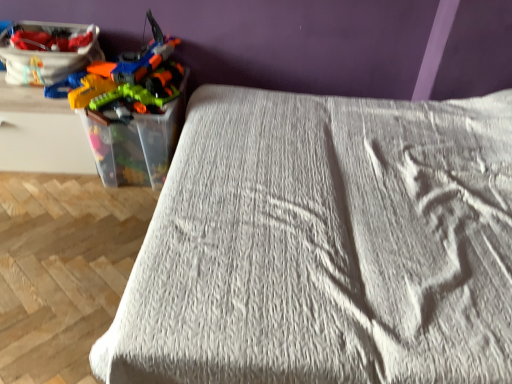
Question: Considering the relative sizes of translucent plastic toy guns at left and white textured bed at center in the image provided, is translucent plastic toy guns at left bigger than white textured bed at center?

Choices:
 (A) yes
 (B) no

Answer: (B)

Question: Is translucent plastic toy guns at left closer to camera compared to white textured bed at center?

Choices:
 (A) yes
 (B) no

Answer: (B)

Question: From the image's perspective, does translucent plastic toy guns at left appear lower than white textured bed at center?

Choices:
 (A) no
 (B) yes

Answer: (A)

Question: Is translucent plastic toy guns at left far away from white textured bed at center?

Choices:
 (A) yes
 (B) no

Answer: (B)

Question: Is translucent plastic toy guns at left oriented away from white textured bed at center?

Choices:
 (A) yes
 (B) no

Answer: (B)

Question: Is translucent plastic toy guns at left next to white textured bed at center and touching it?

Choices:
 (A) no
 (B) yes

Answer: (A)

Question: Does matte plastic toy box at upper left come behind translucent plastic toy guns at left?

Choices:
 (A) no
 (B) yes

Answer: (B)

Question: Can we say matte plastic toy box at upper left lies outside translucent plastic toy guns at left?

Choices:
 (A) no
 (B) yes

Answer: (A)

Question: Can you confirm if matte plastic toy box at upper left is bigger than translucent plastic toy guns at left?

Choices:
 (A) no
 (B) yes

Answer: (A)

Question: From the image's perspective, would you say matte plastic toy box at upper left is shown under translucent plastic toy guns at left?

Choices:
 (A) yes
 (B) no

Answer: (B)

Question: Does matte plastic toy box at upper left appear on the left side of translucent plastic toy guns at left?

Choices:
 (A) no
 (B) yes

Answer: (B)

Question: Does matte plastic toy box at upper left have a greater height compared to translucent plastic toy guns at left?

Choices:
 (A) yes
 (B) no

Answer: (B)

Question: Would you say white textured bed at center is a long distance from translucent plastic toy guns at left?

Choices:
 (A) no
 (B) yes

Answer: (A)